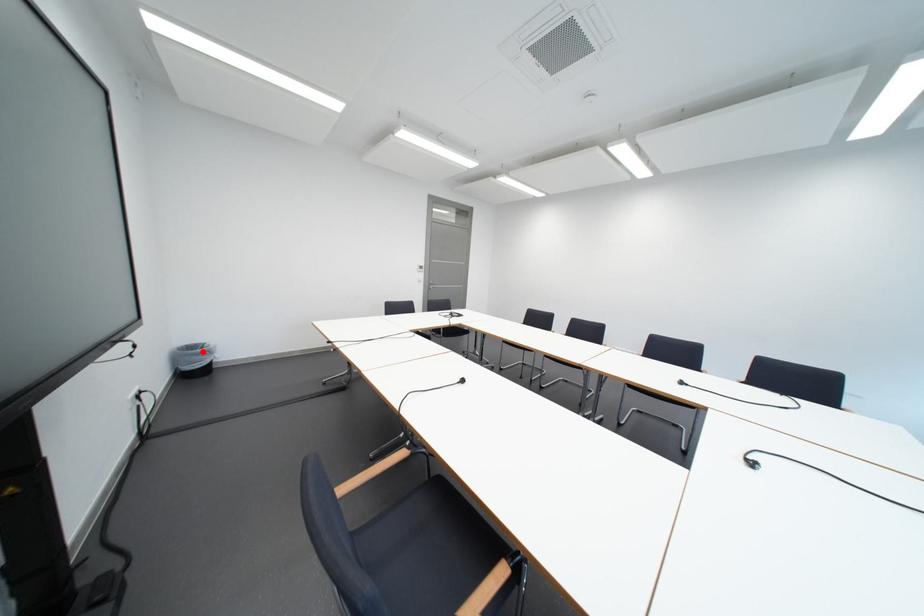
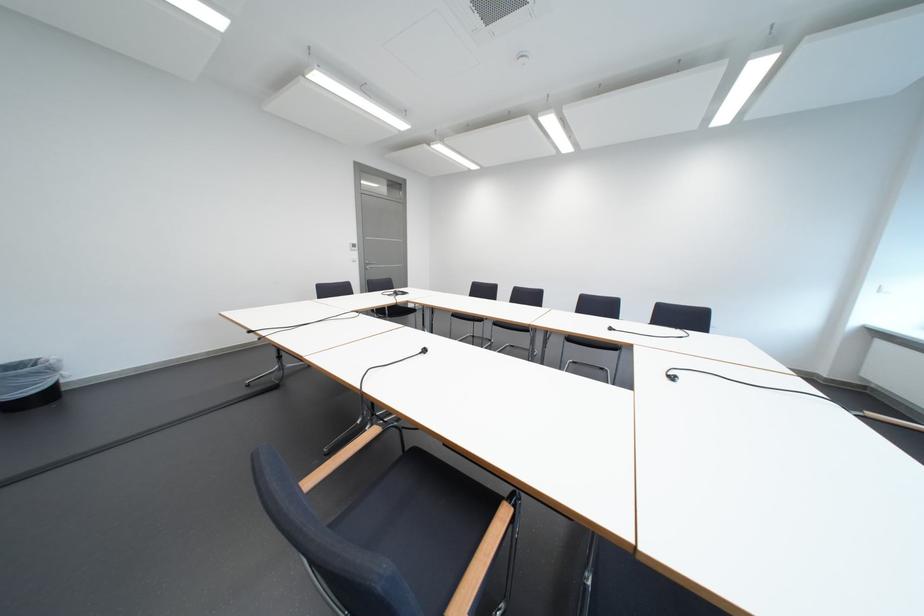
Find the pixel in the second image that matches the highlighted location in the first image.

(23, 373)